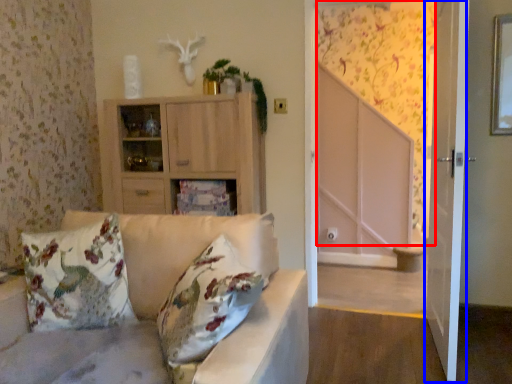
Question: Which of the following is the farthest to the observer, curtain (highlighted by a red box) or screen door (highlighted by a blue box)?

Choices:
 (A) curtain
 (B) screen door

Answer: (A)